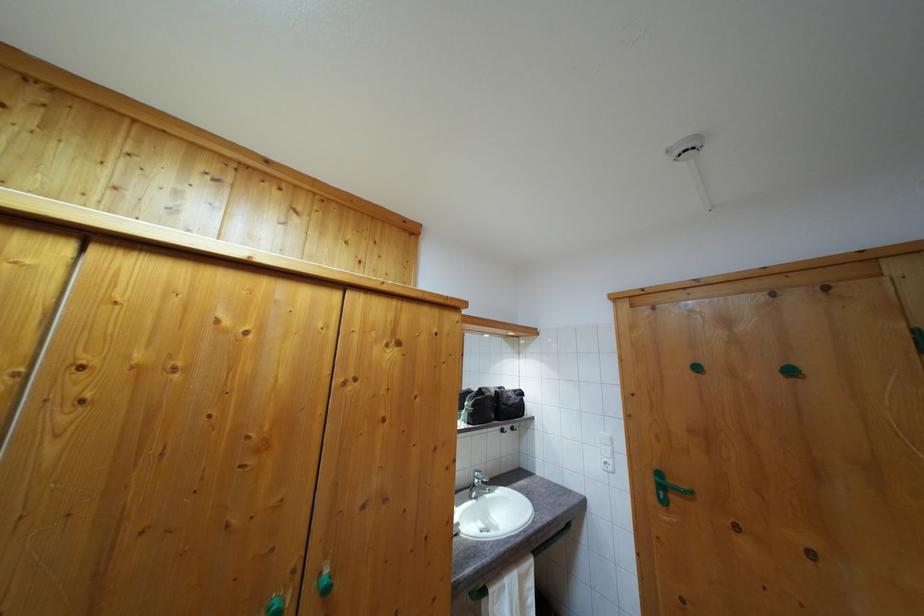
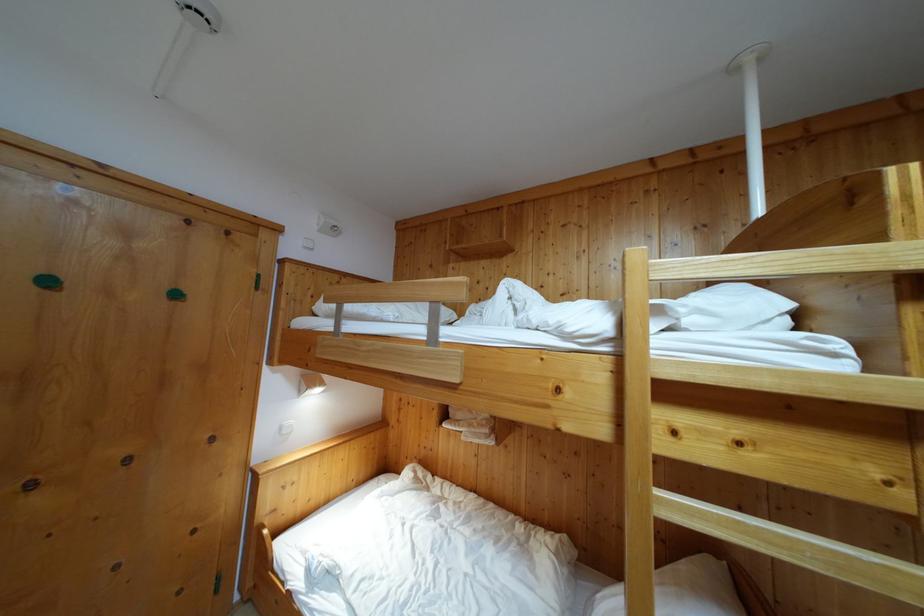
Question: Based on the continuous images, in which direction is the camera rotating? Reply with the corresponding letter.

Choices:
 (A) Left
 (B) Right
 (C) Up
 (D) Down

Answer: (B)